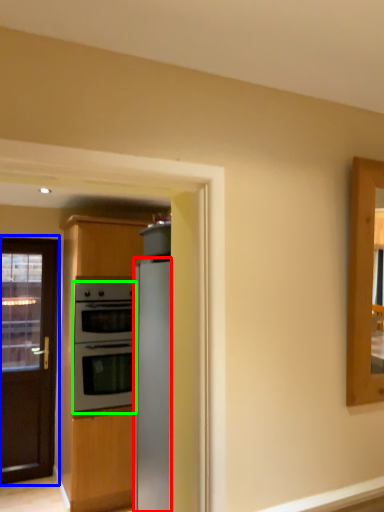
Question: Which is nearer to the refrigerator (highlighted by a red box)? door (highlighted by a blue box) or oven (highlighted by a green box).

Choices:
 (A) door
 (B) oven

Answer: (B)